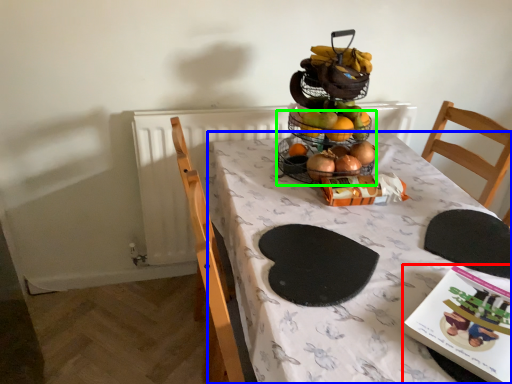
Question: Considering the real-world distances, which object is closest to book (highlighted by a red box)? table (highlighted by a blue box) or basket (highlighted by a green box).

Choices:
 (A) table
 (B) basket

Answer: (A)